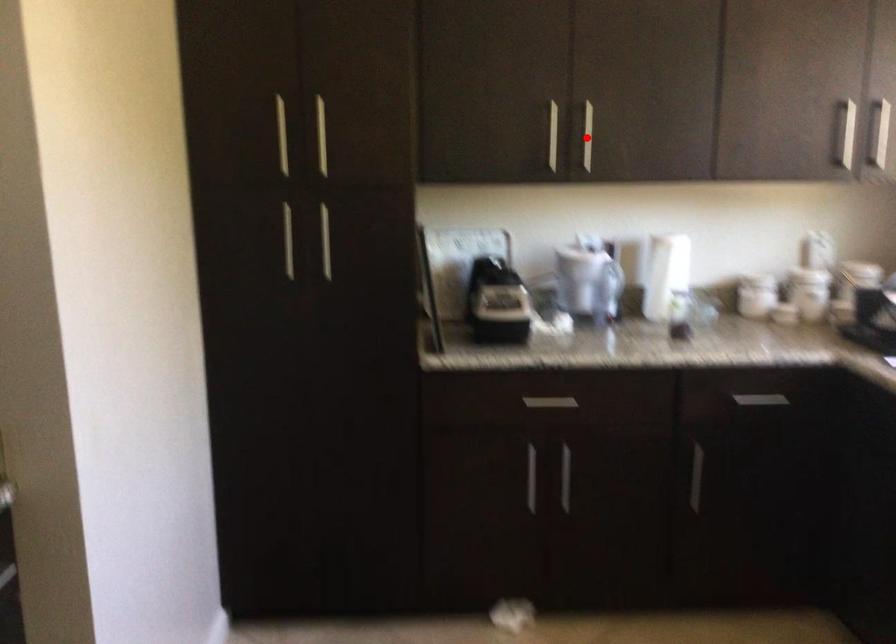
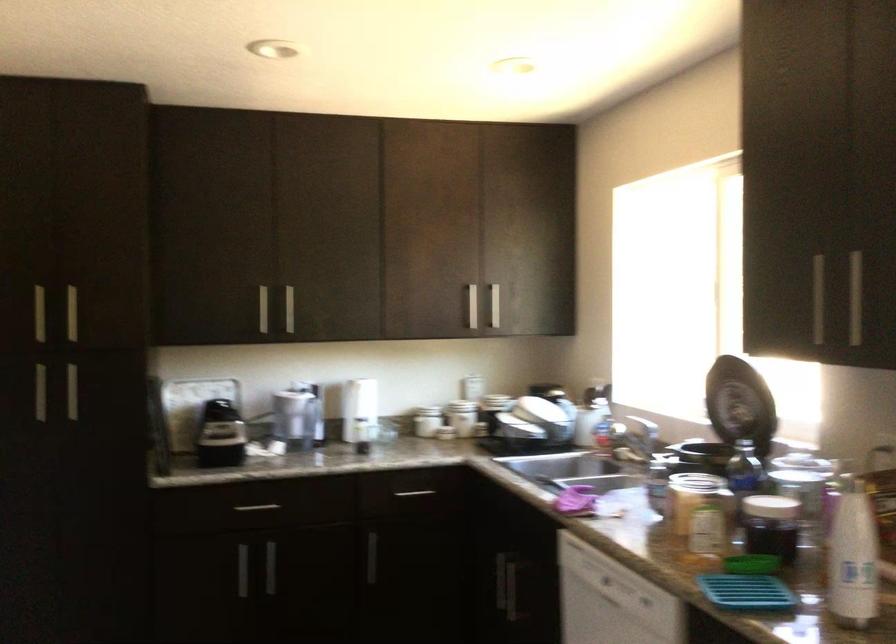
Question: I am providing you with two images of the same scene from different viewpoints. Image1 has a red point marked. In image2, the corresponding 3D location appears at what relative position? Reply with the corresponding letter.

Choices:
 (A) Closer
 (B) Farther

Answer: (B)